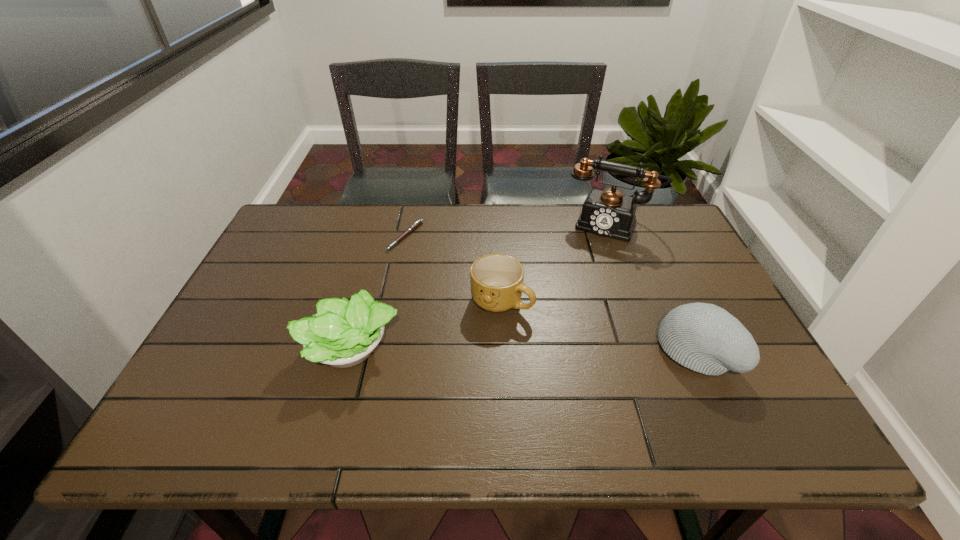
In order to click on free space located at the nib of the pen in this screenshot , I will do `click(427, 279)`.

This screenshot has height=540, width=960. What are the coordinates of `vacant space located 0.300m at the nib of the pen` in the screenshot? It's located at (451, 316).

Locate an element on the screen. free space located 0.090m at the nib of the pen is located at coordinates (421, 268).

Identify the location of free region located 0.300m on the side with the handle of the mug. This screenshot has width=960, height=540. (623, 392).

You are a GUI agent. You are given a task and a screenshot of the screen. Output one action in this format:
    pyautogui.click(x=<x>, y=<y>)
    Task: Click on the free space located 0.260m on the side with the handle of the mug
    The width and height of the screenshot is (960, 540).
    Given the screenshot: What is the action you would take?
    pyautogui.click(x=608, y=380)

At what (x,y) coordinates should I click in order to perform the action: click on free space located 0.190m on the side with the handle of the mug. Please return your answer as a coordinate pair (x, y). This screenshot has width=960, height=540. Looking at the image, I should click on point(583,361).

Locate an element on the screen. Image resolution: width=960 pixels, height=540 pixels. telephone at the far edge is located at coordinates (609, 213).

Locate an element on the screen. The image size is (960, 540). pen that is at the far edge is located at coordinates (419, 222).

At what (x,y) coordinates should I click in order to perform the action: click on lettuce that is at the near edge. Please return your answer as a coordinate pair (x, y). The image size is (960, 540). Looking at the image, I should click on (343, 333).

Find the location of a particular element. The height and width of the screenshot is (540, 960). beanie at the near edge is located at coordinates (705, 338).